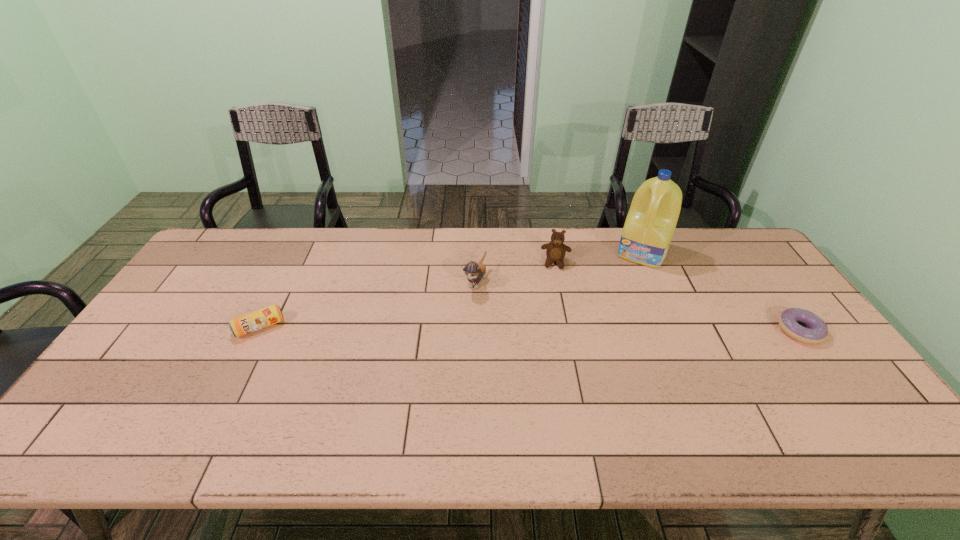
Where is `free space on the desktop that is between the beer can and the rightmost object and is positioned on the label of the tallest object`? free space on the desktop that is between the beer can and the rightmost object and is positioned on the label of the tallest object is located at coordinates (608, 329).

Locate an element on the screen. free space on the desktop that is between the leftmost object and the shortest object and is positioned on the front-facing side of the kitten is located at coordinates (448, 328).

Find the location of a particular element. The width and height of the screenshot is (960, 540). free space on the desktop that is between the beer can and the rightmost object and is positioned at the face of the third object from left to right is located at coordinates (550, 329).